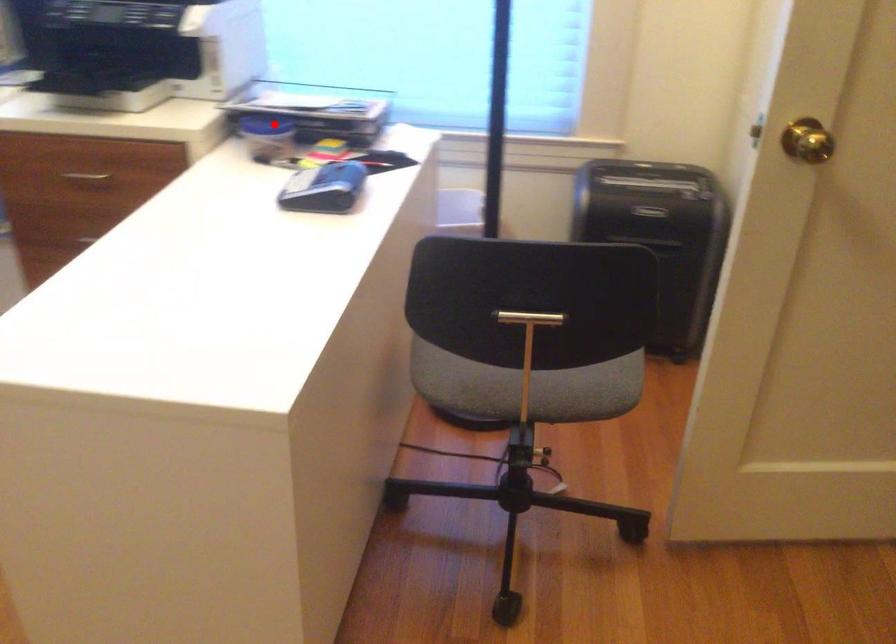
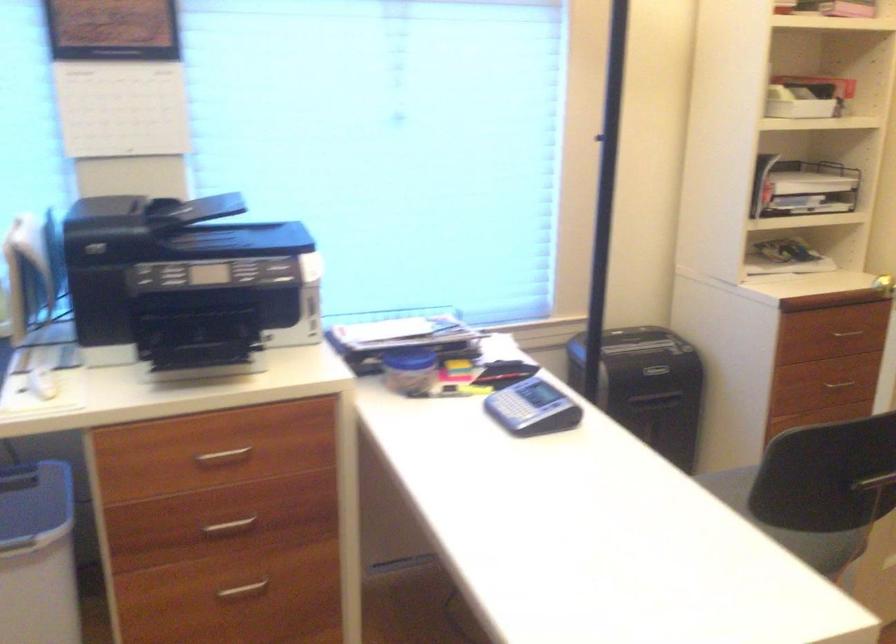
The point at the highlighted location is marked in the first image. Where is the corresponding point in the second image?

(409, 359)